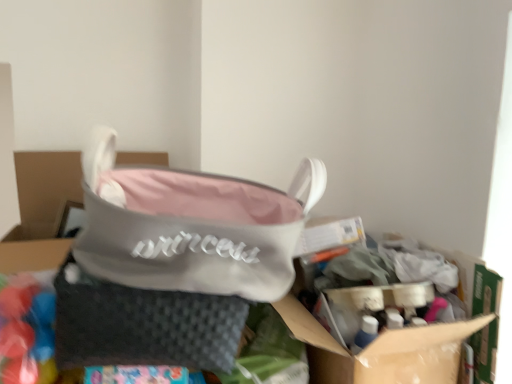
Describe the element at coordinates (143, 324) in the screenshot. This screenshot has width=512, height=384. I see `gray woven pouch at center` at that location.

Measure the distance between point (345, 354) and camera.

Point (345, 354) is 80.00 centimeters from camera.

Find the location of `pink fabric handbag at center`. pink fabric handbag at center is located at coordinates (177, 233).

Find the location of a particular element. The height and width of the screenshot is (384, 512). gray woven pouch at center is located at coordinates (143, 324).

Is pink fabric handbag at center surrounded by cardboard box at center?

Actually, pink fabric handbag at center is outside cardboard box at center.

Which point is more distant from viewer, (331,370) or (87,168)?

The point (331,370) is farther from the camera.

Which object is positioned more to the left, cardboard box at center or pink fabric handbag at center?

pink fabric handbag at center is more to the left.

Which object is further away from the camera, cardboard box at center or pink fabric handbag at center?

cardboard box at center is further from the camera.

From their relative heights in the image, would you say gray woven pouch at center is taller or shorter than pink fabric handbag at center?

Considering their sizes, gray woven pouch at center has less height than pink fabric handbag at center.

Measure the distance between gray woven pouch at center and pink fabric handbag at center.

gray woven pouch at center and pink fabric handbag at center are 3.60 inches apart.

Can you confirm if gray woven pouch at center is smaller than pink fabric handbag at center?

Indeed, gray woven pouch at center has a smaller size compared to pink fabric handbag at center.

Does gray woven pouch at center have a greater width compared to pink fabric handbag at center?

Correct, the width of gray woven pouch at center exceeds that of pink fabric handbag at center.

Can you confirm if pink fabric handbag at center is thinner than gray woven pouch at center?

Correct, the width of pink fabric handbag at center is less than that of gray woven pouch at center.

At what (x,y) coordinates should I click in order to perform the action: click on pouch behind the pink fabric handbag at center. Please return your answer as a coordinate pair (x, y). This screenshot has height=384, width=512. Looking at the image, I should click on (143, 324).

Is pink fabric handbag at center spatially inside gray woven pouch at center, or outside of it?

pink fabric handbag at center cannot be found inside gray woven pouch at center.

Visually, is pink fabric handbag at center positioned to the left or to the right of gray woven pouch at center?

From the image, it's evident that pink fabric handbag at center is to the right of gray woven pouch at center.

From a real-world perspective, who is located higher, cardboard box at center or gray woven pouch at center?

In real-world perspective, gray woven pouch at center is above.

Is cardboard box at center positioned far away from gray woven pouch at center?

They are positioned close to each other.

Is cardboard box at center looking in the opposite direction of gray woven pouch at center?

No, cardboard box at center's orientation is not away from gray woven pouch at center.

Who is shorter, cardboard box at center or gray woven pouch at center?

With less height is gray woven pouch at center.

Consider the image. From a real-world perspective, does gray woven pouch at center sit lower than cardboard box at center?

No, from a real-world perspective, gray woven pouch at center is not under cardboard box at center.

Is gray woven pouch at center positioned with its back to cardboard box at center?

That's not correct — gray woven pouch at center is not looking away from cardboard box at center.

Considering the sizes of objects gray woven pouch at center and cardboard box at center in the image provided, who is bigger, gray woven pouch at center or cardboard box at center?

Bigger between the two is cardboard box at center.

Is gray woven pouch at center far from cardboard box at center?

No, there isn't a large distance between gray woven pouch at center and cardboard box at center.

Who is shorter, pink fabric handbag at center or cardboard box at center?

cardboard box at center.

Between pink fabric handbag at center and cardboard box at center, which one appears on the left side from the viewer's perspective?

pink fabric handbag at center.

What's the angular difference between pink fabric handbag at center and cardboard box at center's facing directions?

They differ by 3.8 degrees in their facing directions.

In order to click on cardboard box below the pink fabric handbag at center (from a real-world perspective) in this screenshot , I will do `click(379, 348)`.

What are the coordinates of `handbag above the cardboard box at center (from the image's perspective)` in the screenshot? It's located at (177, 233).

Locate an element on the screen. pouch on the left of pink fabric handbag at center is located at coordinates (143, 324).

Considering their positions, is pink fabric handbag at center positioned further to gray woven pouch at center than cardboard box at center?

Based on the image, cardboard box at center appears to be further to gray woven pouch at center.

Consider the image. From the image, which object appears to be farther from pink fabric handbag at center, cardboard box at center or gray woven pouch at center?

cardboard box at center is positioned further to the anchor pink fabric handbag at center.

Looking at the image, which one is located further to gray woven pouch at center, cardboard box at center or pink fabric handbag at center?

Among the two, cardboard box at center is located further to gray woven pouch at center.

Considering their positions, is gray woven pouch at center positioned closer to pink fabric handbag at center than cardboard box at center?

gray woven pouch at center lies closer to pink fabric handbag at center than the other object.

Looking at the image, which one is located further to cardboard box at center, pink fabric handbag at center or gray woven pouch at center?

gray woven pouch at center is positioned further to the anchor cardboard box at center.

Which object lies nearer to the anchor point cardboard box at center, gray woven pouch at center or pink fabric handbag at center?

The object closer to cardboard box at center is pink fabric handbag at center.

This screenshot has height=384, width=512. What are the coordinates of `handbag between gray woven pouch at center and cardboard box at center in the horizontal direction` in the screenshot? It's located at (177, 233).